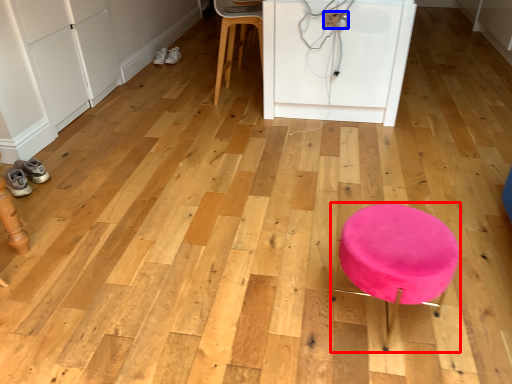
Question: Which object appears farthest to the camera in this image, furniture (highlighted by a red box) or electric outlet (highlighted by a blue box)?

Choices:
 (A) furniture
 (B) electric outlet

Answer: (B)